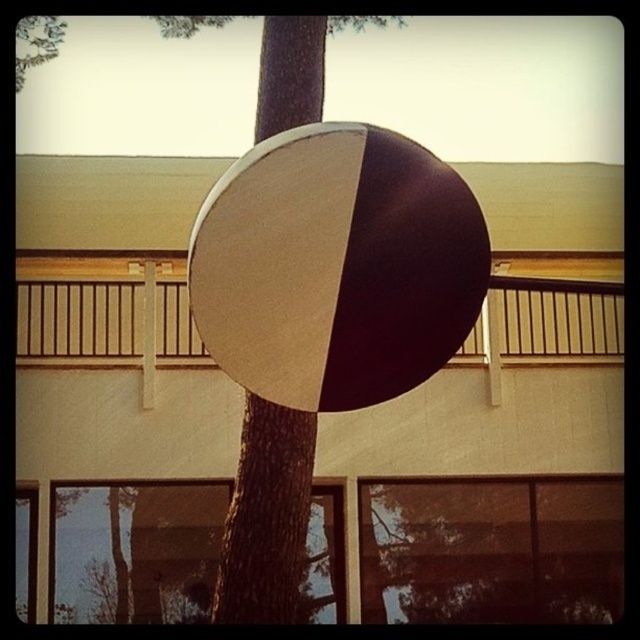
You are standing in a park and see the matte white and dark brown beach ball at center and the brown textured tree trunk at center. Which object is shorter?

The matte white and dark brown beach ball at center is shorter than the brown textured tree trunk at center.

You are standing in a park and see a tree with a large spherical object attached to its trunk. The object is a matte white and dark brown beach ball located at point (337, 266). If you want to place a new decorative item exactly 0.3 units to the left of this beach ball, where would its coordinates be?

The new decorative item would be placed at coordinates 0.117, 0.527 because subtracting 0.3 from the x coordinate of the matte white and dark brown beach ball at center gives 0.417 minus 0.3 equals 0.117, while the y coordinate remains the same at 0.527.

You are planning to place a new bench in the park. The bench you have is 1.5 meters wide. Looking at the image, can the bench fit in the space between the matte white and dark brown beach ball at center and the wooden at center?

The matte white and dark brown beach ball at center is less wide than the wooden at center. Since the bench is 1.5 meters wide, it depends on the actual width difference. However, the description only states the beach ball is narrower, but without exact measurements, we cannot confirm if the space is sufficient.